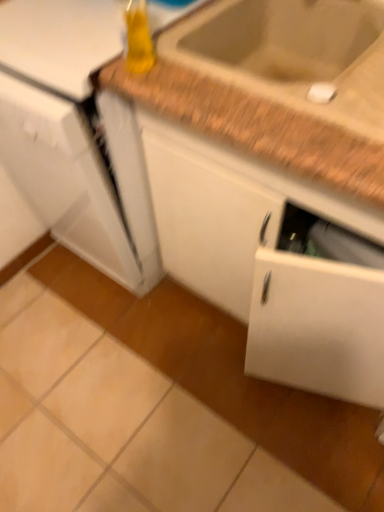
Question: Would you say brown speckled granite at upper right is part of white glossy refrigerator at left's contents?

Choices:
 (A) yes
 (B) no

Answer: (B)

Question: Is white glossy refrigerator at left oriented away from brown speckled granite at upper right?

Choices:
 (A) yes
 (B) no

Answer: (B)

Question: Is white glossy refrigerator at left bigger than brown speckled granite at upper right?

Choices:
 (A) no
 (B) yes

Answer: (B)

Question: Can you confirm if white glossy refrigerator at left is positioned to the right of brown speckled granite at upper right?

Choices:
 (A) yes
 (B) no

Answer: (B)

Question: Is white glossy refrigerator at left facing towards brown speckled granite at upper right?

Choices:
 (A) yes
 (B) no

Answer: (B)

Question: Considering the relative sizes of white glossy refrigerator at left and brown speckled granite at upper right in the image provided, is white glossy refrigerator at left thinner than brown speckled granite at upper right?

Choices:
 (A) no
 (B) yes

Answer: (A)

Question: Is translucent yellow bottle at upper center smaller than white glossy refrigerator at left?

Choices:
 (A) yes
 (B) no

Answer: (A)

Question: Is translucent yellow bottle at upper center thinner than white glossy refrigerator at left?

Choices:
 (A) no
 (B) yes

Answer: (B)

Question: Is translucent yellow bottle at upper center shorter than white glossy refrigerator at left?

Choices:
 (A) yes
 (B) no

Answer: (A)

Question: From a real-world perspective, is translucent yellow bottle at upper center located higher than white glossy refrigerator at left?

Choices:
 (A) no
 (B) yes

Answer: (B)

Question: Is translucent yellow bottle at upper center next to white glossy refrigerator at left and touching it?

Choices:
 (A) no
 (B) yes

Answer: (A)

Question: Is translucent yellow bottle at upper center outside of white glossy refrigerator at left?

Choices:
 (A) yes
 (B) no

Answer: (A)

Question: Can you confirm if white matte cabinet at center is shorter than white glossy refrigerator at left?

Choices:
 (A) yes
 (B) no

Answer: (A)